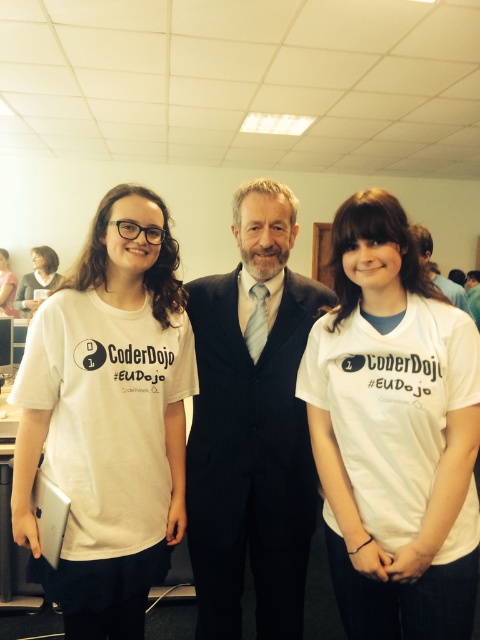
Which is behind, point (349, 596) or point (4, 250)?

Positioned behind is point (4, 250).

Who is more forward, (462, 429) or (2, 280)?

Point (462, 429)

What are the coordinates of `white cotton t-shirt at center` in the screenshot? It's located at (394, 433).

Is white matte t-shirt at left shorter than white t-shirt at center?

Incorrect, white matte t-shirt at left's height does not fall short of white t-shirt at center's.

Which of these two, white matte t-shirt at left or white t-shirt at center, stands taller?

white matte t-shirt at left is taller.

This screenshot has height=640, width=480. What do you see at coordinates (108, 417) in the screenshot? I see `white matte t-shirt at left` at bounding box center [108, 417].

Where is `white matte t-shirt at left`? white matte t-shirt at left is located at coordinates (108, 417).

Between point (316, 442) and point (431, 262), which one is positioned in front?

Positioned in front is point (316, 442).

Who is more forward, (337, 371) or (452, 284)?

Point (337, 371) is in front.

Where is `white cotton t-shirt at center`? white cotton t-shirt at center is located at coordinates (394, 433).